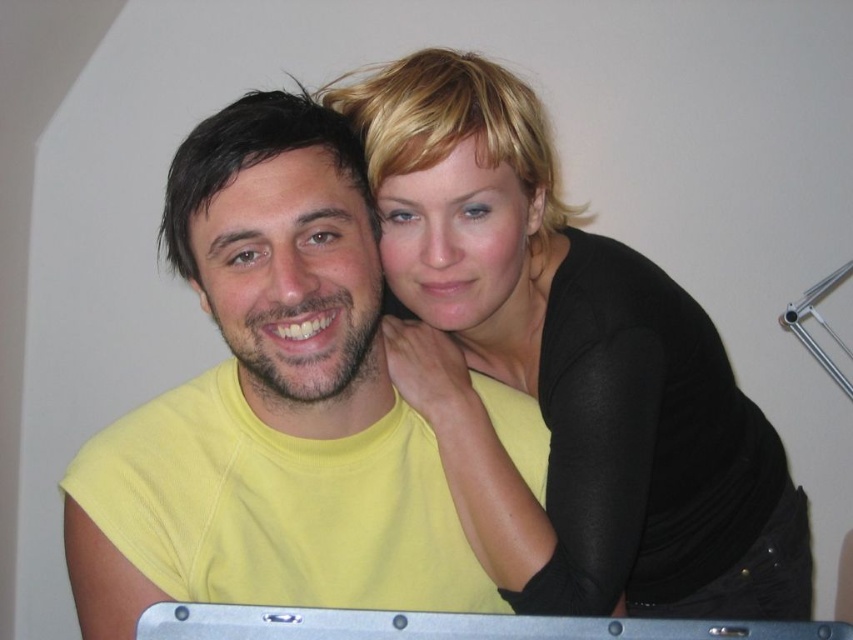
Question: Which point is closer to the camera taking this photo?

Choices:
 (A) (662, 636)
 (B) (506, 308)
 (C) (312, 225)

Answer: (A)

Question: Can you confirm if yellow matte t-shirt at center is thinner than silver metallic laptop at lower center?

Choices:
 (A) yes
 (B) no

Answer: (A)

Question: Which of these objects is positioned farthest from the black matte shirt at upper right?

Choices:
 (A) yellow matte t-shirt at center
 (B) silver metallic laptop at lower center

Answer: (B)

Question: Can you confirm if black matte shirt at upper right is wider than yellow matte t-shirt at center?

Choices:
 (A) yes
 (B) no

Answer: (A)

Question: In this image, where is black matte shirt at upper right located relative to silver metallic laptop at lower center?

Choices:
 (A) above
 (B) below

Answer: (A)

Question: Among these points, which one is farthest from the camera?

Choices:
 (A) (306, 616)
 (B) (556, 579)

Answer: (B)